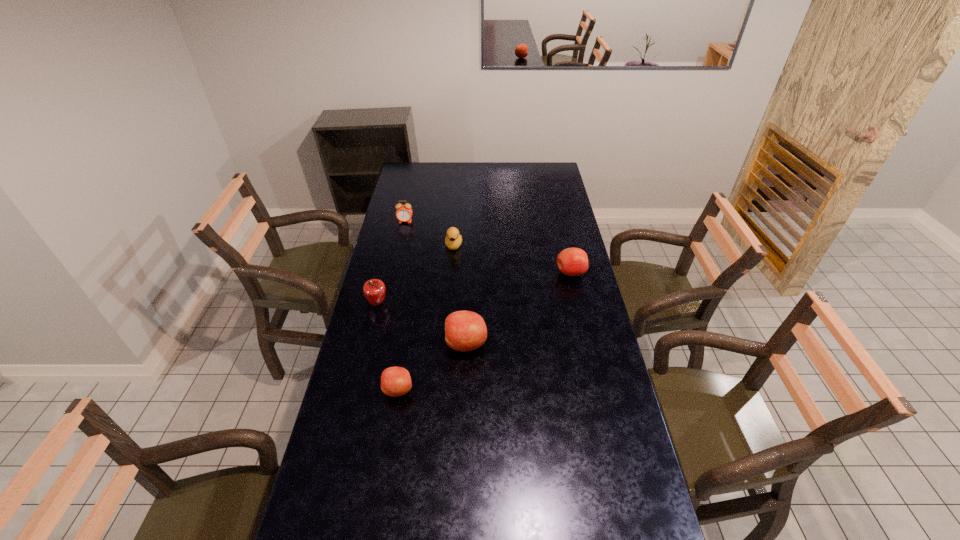
You are a GUI agent. You are given a task and a screenshot of the screen. Output one action in this format:
    pyautogui.click(x=<x>, y=<y>)
    Task: Click on the vacant point located between the tallest object and the rightmost apple
    
    Given the screenshot: What is the action you would take?
    pyautogui.click(x=518, y=308)

The image size is (960, 540). What are the coordinates of `empty space that is in between the rightmost object and the duckling` in the screenshot? It's located at (513, 259).

This screenshot has height=540, width=960. I want to click on free spot between the alarm clock and the rightmost object, so [x=488, y=247].

This screenshot has width=960, height=540. What are the coordinates of `the fifth closest object to the third apple from left to right` in the screenshot? It's located at (404, 212).

This screenshot has width=960, height=540. I want to click on object that is the fourth nearest to the farthest apple, so click(404, 212).

The height and width of the screenshot is (540, 960). In order to click on apple that is the closest to the tallest object in this screenshot , I will do `click(395, 381)`.

Point out which apple is positioned as the nearest to the third nearest apple. Please provide its 2D coordinates. Your answer should be formatted as a tuple, i.e. [(x, y)], where the tuple contains the x and y coordinates of a point satisfying the conditions above.

[(464, 330)]

Identify the location of free spot that satisfies the following two spatial constraints: 1. on the face of the nearest object; 2. on the right side of the alarm clock. (369, 390).